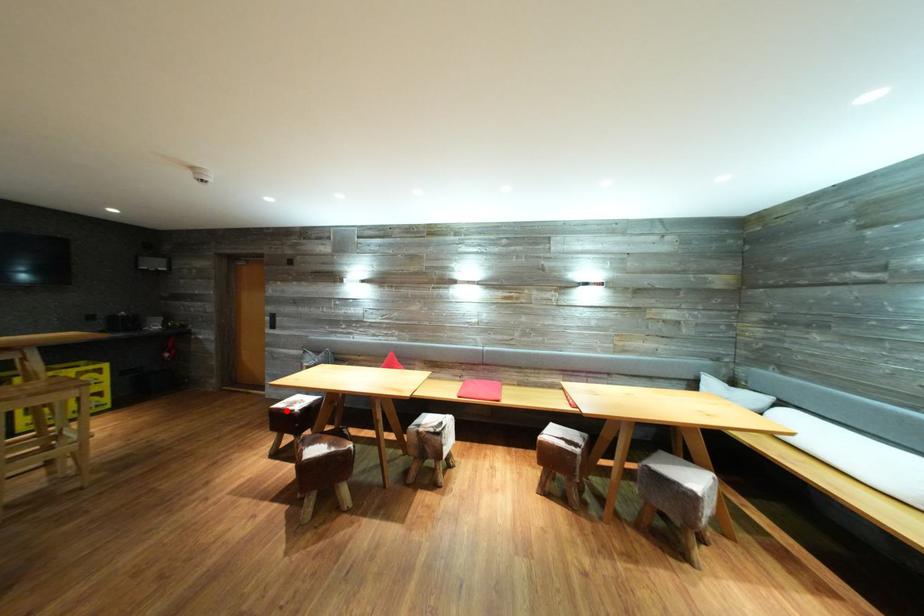
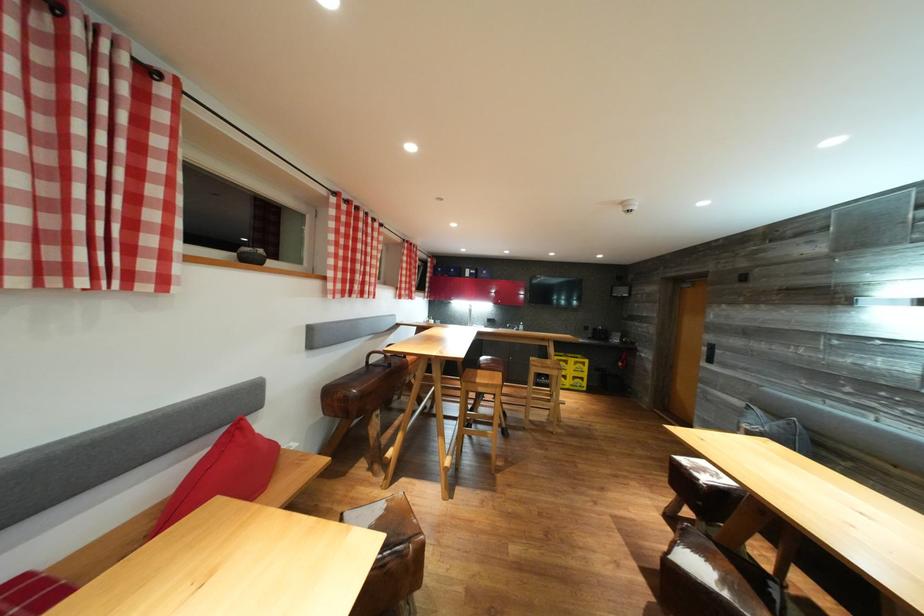
Locate, in the second image, the point that corresponds to the highlighted location in the first image.

(689, 466)